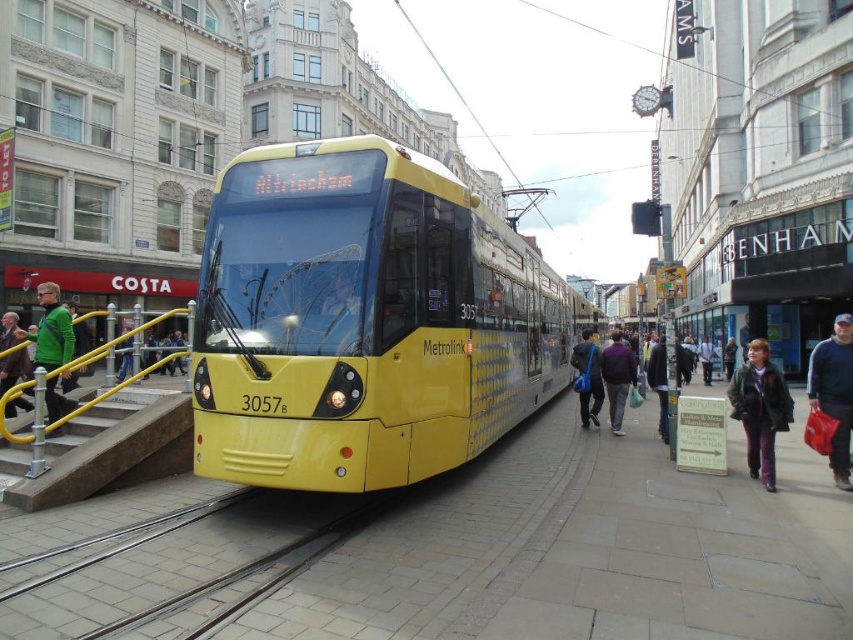
Can you confirm if dark blue fabric jacket at lower right is wider than green fabric jacket at left?

No, dark blue fabric jacket at lower right is not wider than green fabric jacket at left.

Between dark blue fabric jacket at lower right and green fabric jacket at left, which one has less height?

dark blue fabric jacket at lower right is shorter.

At what (x,y) coordinates should I click in order to perform the action: click on dark blue fabric jacket at lower right. Please return your answer as a coordinate pair (x, y). The width and height of the screenshot is (853, 640). Looking at the image, I should click on (834, 392).

Identify the location of dark blue fabric jacket at lower right. The image size is (853, 640). (834, 392).

Does green fuzzy coat at lower right have a smaller size compared to dark blue fabric jacket at lower right?

Indeed, green fuzzy coat at lower right has a smaller size compared to dark blue fabric jacket at lower right.

Who is more forward, [758,422] or [836,467]?

Positioned in front is point [836,467].

This screenshot has height=640, width=853. In order to click on green fuzzy coat at lower right in this screenshot , I will do `click(759, 410)`.

Which is in front, point (753, 394) or point (593, 406)?

Point (753, 394) is more forward.

Does point (753, 433) lie behind point (602, 401)?

No, (753, 433) is in front of (602, 401).

This screenshot has width=853, height=640. What do you see at coordinates (759, 410) in the screenshot? I see `green fuzzy coat at lower right` at bounding box center [759, 410].

Image resolution: width=853 pixels, height=640 pixels. Identify the location of green fuzzy coat at lower right. (759, 410).